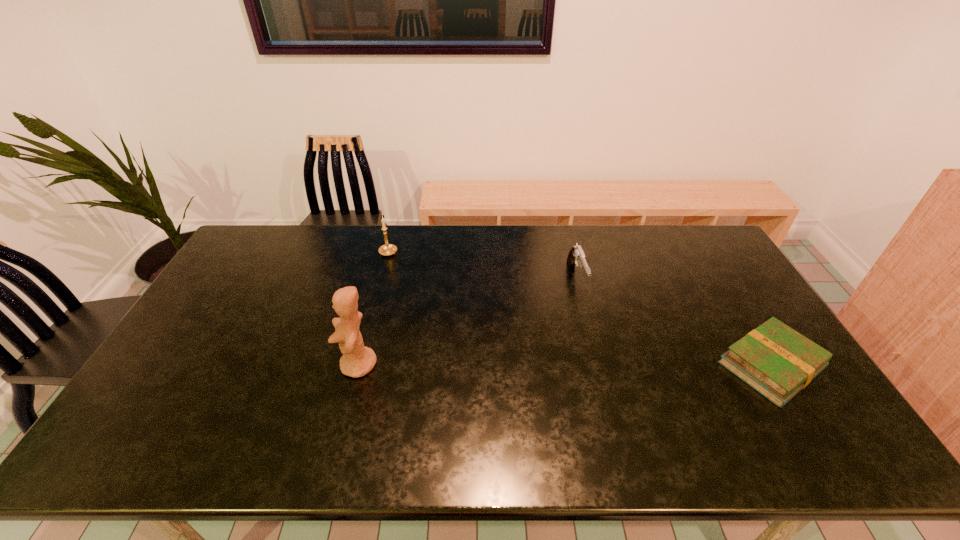
The image size is (960, 540). Find the location of `figurine`. figurine is located at coordinates (357, 360).

Locate an element on the screen. The height and width of the screenshot is (540, 960). the shortest object is located at coordinates (774, 359).

Find the location of a particular element. This screenshot has height=540, width=960. the rightmost object is located at coordinates (774, 359).

Where is `the farthest object`? the farthest object is located at coordinates (388, 249).

The height and width of the screenshot is (540, 960). Identify the location of the third shortest object. (388, 249).

This screenshot has width=960, height=540. What are the coordinates of `gun` in the screenshot? It's located at (576, 256).

Locate an element on the screen. the second shortest object is located at coordinates (576, 256).

I want to click on free space located 0.400m on the front-facing side of the tallest object, so click(x=195, y=364).

The width and height of the screenshot is (960, 540). Find the location of `vacant space situated 0.280m on the front-facing side of the tallest object`. vacant space situated 0.280m on the front-facing side of the tallest object is located at coordinates (239, 364).

The width and height of the screenshot is (960, 540). Identify the location of free space located on the front-facing side of the tallest object. (206, 364).